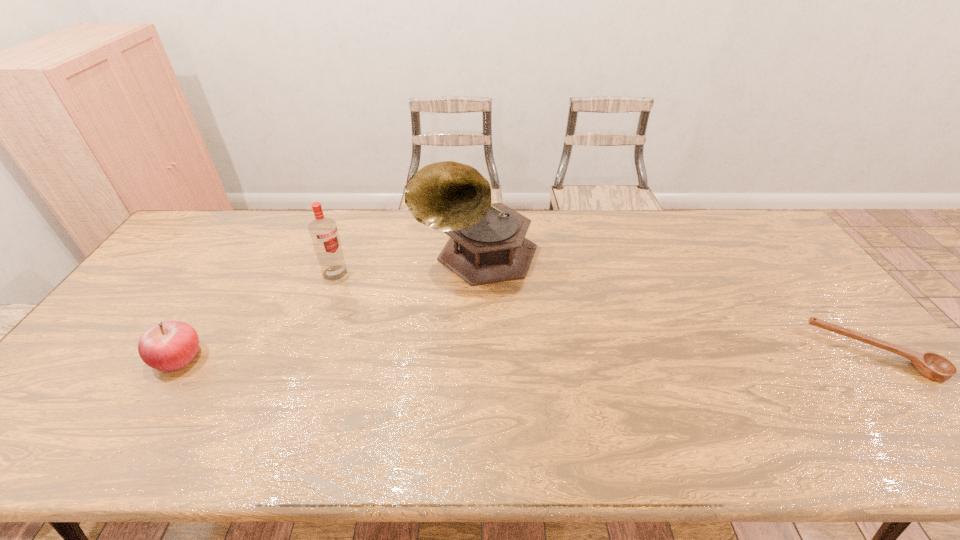
The image size is (960, 540). What are the coordinates of `the second shortest object` in the screenshot? It's located at (170, 345).

You are a GUI agent. You are given a task and a screenshot of the screen. Output one action in this format:
    pyautogui.click(x=<x>, y=<y>)
    Task: Click on the leftmost object
    The width and height of the screenshot is (960, 540).
    Given the screenshot: What is the action you would take?
    pyautogui.click(x=170, y=345)

Locate an element on the screen. The height and width of the screenshot is (540, 960). wooden spoon is located at coordinates (932, 366).

The image size is (960, 540). Find the location of `the rightmost object`. the rightmost object is located at coordinates (932, 366).

Where is `phonograph record`? This screenshot has width=960, height=540. phonograph record is located at coordinates (487, 244).

Find the location of a particular element. the tallest object is located at coordinates (487, 244).

Locate an element on the screen. the third object from right to left is located at coordinates tap(323, 231).

I want to click on the third shortest object, so pos(323,231).

This screenshot has height=540, width=960. What are the coordinates of `free space located 0.260m on the back of the third tallest object` in the screenshot? It's located at (230, 274).

Image resolution: width=960 pixels, height=540 pixels. I want to click on vacant space located 0.220m on the back of the wooden spoon, so point(807,274).